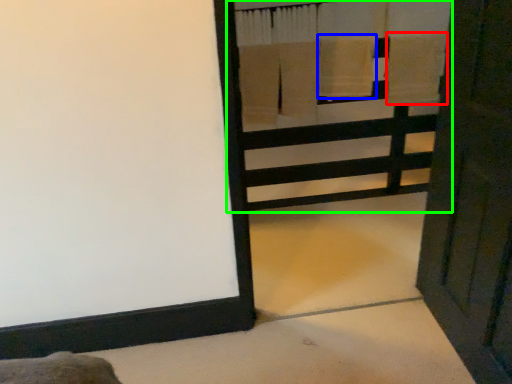
Question: Based on their relative distances, which object is nearer to bath towel (highlighted by a red box)? Choose from bath towel (highlighted by a blue box) and bunk bed (highlighted by a green box).

Choices:
 (A) bath towel
 (B) bunk bed

Answer: (A)